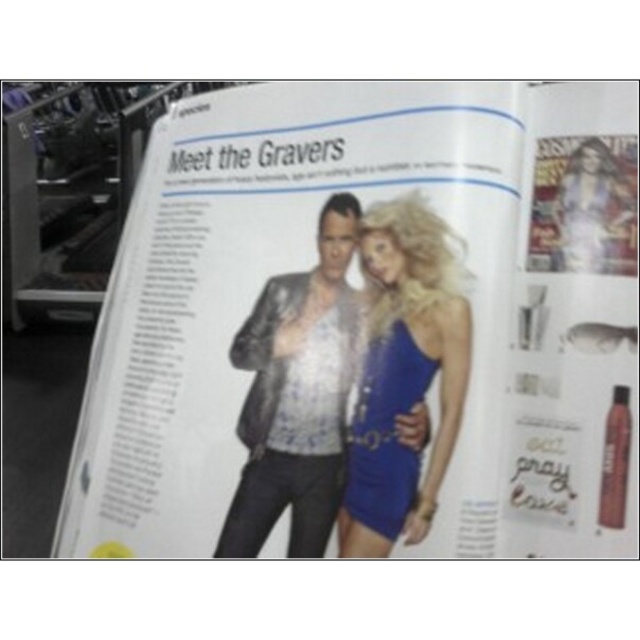
Question: Which point is closer to the camera taking this photo?

Choices:
 (A) (317, 452)
 (B) (362, 243)
 (C) (598, 541)

Answer: (C)

Question: Among these points, which one is nearest to the camera?

Choices:
 (A) (369, 371)
 (B) (196, 554)
 (C) (403, 433)

Answer: (C)

Question: Does shiny black leather jacket at center appear under shiny blue dress at center?

Choices:
 (A) no
 (B) yes

Answer: (B)

Question: Does shiny black leather jacket at center have a smaller size compared to shiny blue dress at center?

Choices:
 (A) yes
 (B) no

Answer: (B)

Question: Which point is closer to the camera?

Choices:
 (A) shiny black leather jacket at center
 (B) matte black magazine at center
 (C) shiny blue dress at center

Answer: (B)

Question: Can you confirm if matte black magazine at center is bigger than shiny black leather jacket at center?

Choices:
 (A) yes
 (B) no

Answer: (A)